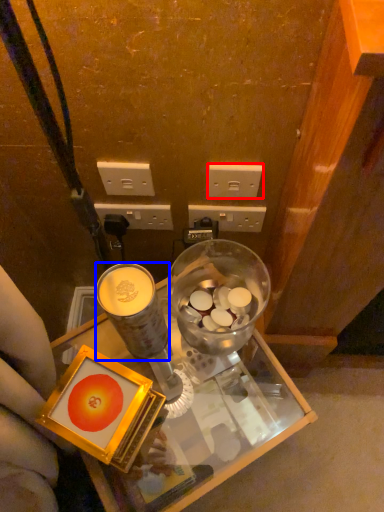
Question: Which object is further to the camera taking this photo, power outlet (highlighted by a red box) or coffee cup (highlighted by a blue box)?

Choices:
 (A) power outlet
 (B) coffee cup

Answer: (A)